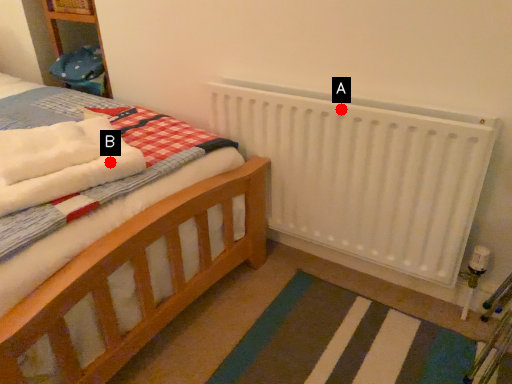
Question: Two points are circled on the image, labeled by A and B beside each circle. Which point is farther to the camera?

Choices:
 (A) A is further
 (B) B is further

Answer: (A)